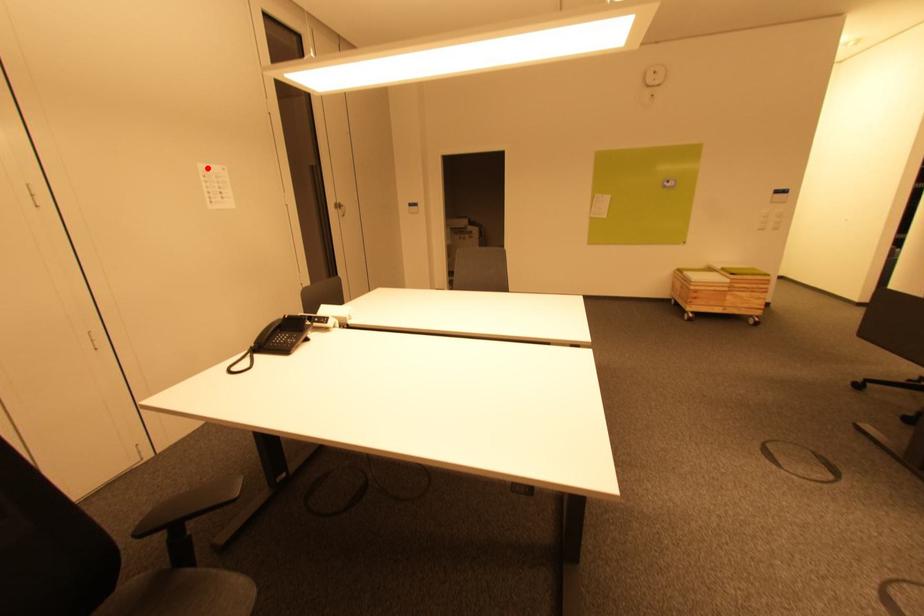
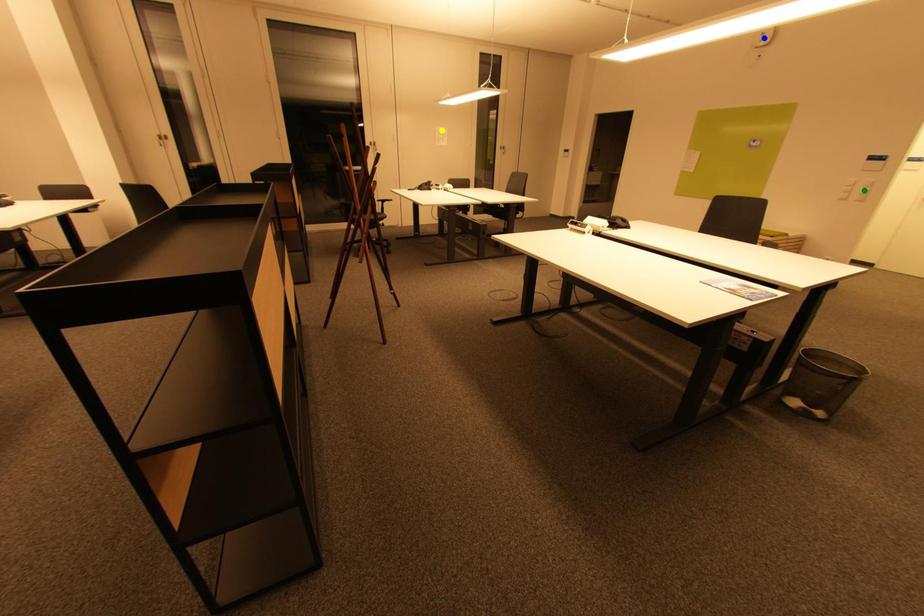
Question: I am providing you with two images of the same scene from different viewpoints. A red point is marked on the first image. You are given multiple points on the second image. Which mark in image 2 goes with the point in image 1?

Choices:
 (A) green point
 (B) yellow point
 (C) blue point

Answer: (B)